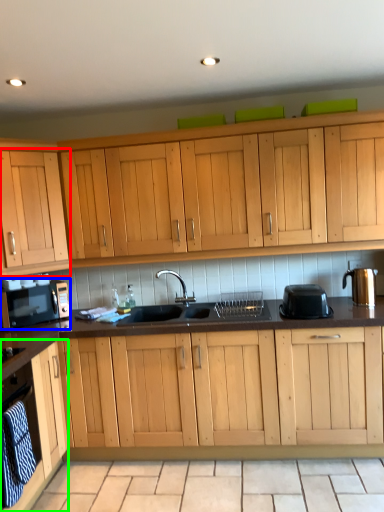
Question: Which is nearer to the cabinetry (highlighted by a red box)? home appliance (highlighted by a blue box) or cabinetry (highlighted by a green box).

Choices:
 (A) home appliance
 (B) cabinetry

Answer: (A)